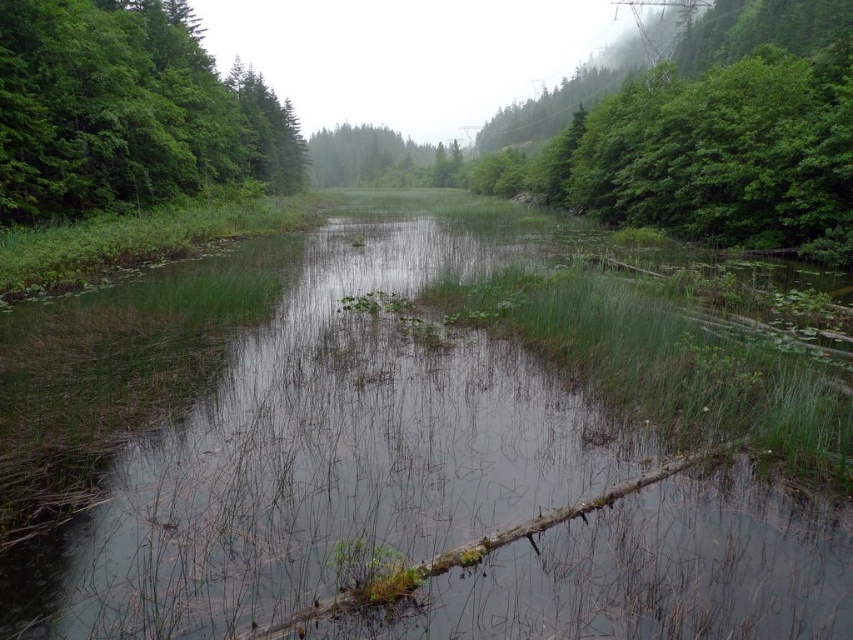
You are standing in the middle of the green grassy stream at center and want to reach the green leafy tree at left. Which direction should you walk to get closer to the tree?

Since the green grassy stream at center is closer to the viewer than the green leafy tree at left, you should walk forward towards the tree to get closer to the green leafy tree at left.

You are planning to install a small bridge over the water between the green leafy tree at upper right and the green leafy tree at left. The bridge needs to be at least 30 meters long to span the distance. Based on the scene description, will the bridge be long enough?

The green leafy tree at upper right and green leafy tree at left are 33.65 meters apart. The bridge needs to be at least 30 meters long, so a 30 meter bridge would not be long enough to span the 33.65 meter distance between the trees.

You are standing in the middle of the waterway and want to reach the green leafy tree at upper right and the green leafy tree at left. Which tree is closer to your right side?

The green leafy tree at upper right is positioned on the right side of green leafy tree at left, so it is closer to your right side.